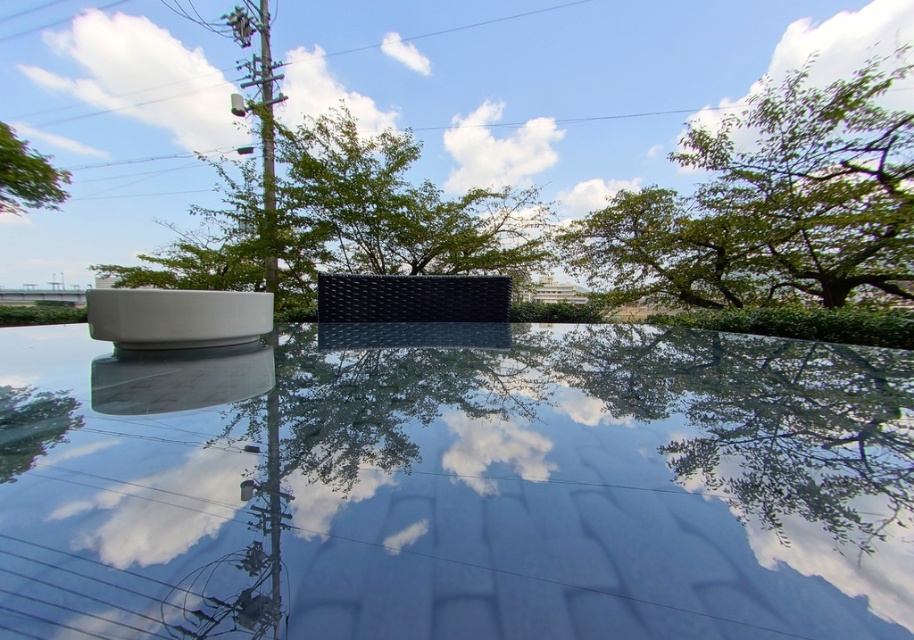
Question: Which object is positioned farthest from the green leafy tree at upper left?

Choices:
 (A) green leafy tree at upper center
 (B) glossy reflective puddle at center
 (C) green leafy tree at upper right

Answer: (B)

Question: Where is glossy reflective puddle at center located in relation to green leafy tree at upper center in the image?

Choices:
 (A) left
 (B) right

Answer: (A)

Question: Can you confirm if green leafy tree at upper right is positioned to the left of green leafy tree at upper center?

Choices:
 (A) yes
 (B) no

Answer: (B)

Question: Which point is closer to the camera?

Choices:
 (A) (25, 202)
 (B) (377, 451)

Answer: (B)

Question: Which object is positioned farthest from the green leafy tree at upper center?

Choices:
 (A) green leafy tree at upper right
 (B) green leafy tree at upper left
 (C) glossy reflective puddle at center

Answer: (B)

Question: Is glossy reflective puddle at center wider than green leafy tree at upper right?

Choices:
 (A) yes
 (B) no

Answer: (B)